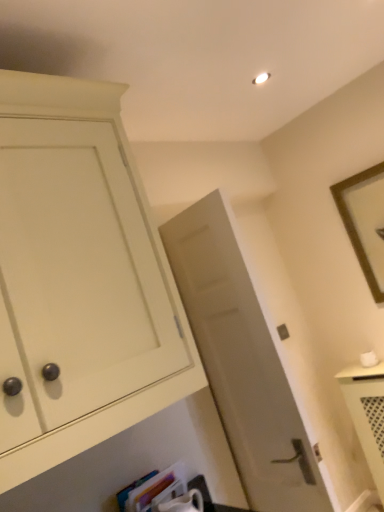
In the scene shown: Measure the distance between point (352,204) and camera.

They are 8.20 feet apart.

Based on the photo, measure the distance between brown wooden picture frame at upper right and camera.

brown wooden picture frame at upper right and camera are 7.76 feet apart from each other.

Where is `brown wooden picture frame at upper right`? brown wooden picture frame at upper right is located at coordinates (365, 222).

Consider the image. Is brown wooden picture frame at upper right spatially inside matte gray door at center, or outside of it?

brown wooden picture frame at upper right is located beyond the bounds of matte gray door at center.

From the picture: Is brown wooden picture frame at upper right further to camera compared to matte gray door at center?

Yes, brown wooden picture frame at upper right is behind matte gray door at center.

Is brown wooden picture frame at upper right bigger than matte gray door at center?

No.

From a real-world perspective, between brown wooden picture frame at upper right and matte gray door at center, who is vertically higher?

brown wooden picture frame at upper right.

Is hardcover book at lower center in contact with matte white cabinet at left?

No, hardcover book at lower center is not next to matte white cabinet at left.

Between hardcover book at lower center and matte white cabinet at left, which one appears on the right side from the viewer's perspective?

hardcover book at lower center.

From a real-world perspective, who is located higher, hardcover book at lower center or matte white cabinet at left?

In real-world perspective, matte white cabinet at left is above.

The width and height of the screenshot is (384, 512). Find the location of `cabinetry above the hardcover book at lower center (from a real-world perspective)`. cabinetry above the hardcover book at lower center (from a real-world perspective) is located at coordinates (79, 279).

Does point (157, 487) appear closer or farther from the camera than point (363, 181)?

Point (157, 487).

From the image's perspective, is hardcover book at lower center on top of brown wooden picture frame at upper right?

Incorrect, from the image's perspective, hardcover book at lower center is lower than brown wooden picture frame at upper right.

Can you confirm if hardcover book at lower center is bigger than brown wooden picture frame at upper right?

No, hardcover book at lower center is not bigger than brown wooden picture frame at upper right.

How different are the orientations of hardcover book at lower center and brown wooden picture frame at upper right in degrees?

89.3 degrees separate the facing orientations of hardcover book at lower center and brown wooden picture frame at upper right.

Is matte gray door at center closer to the viewer compared to hardcover book at lower center?

No, matte gray door at center is further to the viewer.

Is matte gray door at center outside of hardcover book at lower center?

Yes, matte gray door at center is outside of hardcover book at lower center.

Are matte gray door at center and hardcover book at lower center far apart?

Actually, matte gray door at center and hardcover book at lower center are a little close together.

Which object is thinner, matte gray door at center or hardcover book at lower center?

Thinner between the two is matte gray door at center.

From a real-world perspective, is brown wooden picture frame at upper right above or below hardcover book at lower center?

Clearly, from a real-world perspective, brown wooden picture frame at upper right is above hardcover book at lower center.

Between brown wooden picture frame at upper right and hardcover book at lower center, which one is positioned behind?

brown wooden picture frame at upper right.

Could you tell me if brown wooden picture frame at upper right is facing hardcover book at lower center?

Yes, brown wooden picture frame at upper right is turned towards hardcover book at lower center.

Considering the sizes of objects matte white cabinet at left and hardcover book at lower center in the image provided, who is wider, matte white cabinet at left or hardcover book at lower center?

matte white cabinet at left is wider.

Does point (98, 170) appear closer or farther from the camera than point (137, 488)?

Clearly, point (98, 170) is closer to the camera than point (137, 488).

Does matte white cabinet at left contain hardcover book at lower center?

Definitely not — hardcover book at lower center is not inside matte white cabinet at left.

Could you tell me if brown wooden picture frame at upper right is facing matte white cabinet at left?

Yes.

From the image's perspective, which is below, brown wooden picture frame at upper right or matte white cabinet at left?

matte white cabinet at left is shown below in the image.

Considering the relative positions of brown wooden picture frame at upper right and matte white cabinet at left in the image provided, is brown wooden picture frame at upper right to the right of matte white cabinet at left from the viewer's perspective?

Yes, brown wooden picture frame at upper right is to the right of matte white cabinet at left.

Is brown wooden picture frame at upper right inside the boundaries of matte white cabinet at left, or outside?

brown wooden picture frame at upper right lies outside matte white cabinet at left.

At what (x,y) coordinates should I click in order to perform the action: click on door on the left of brown wooden picture frame at upper right. Please return your answer as a coordinate pair (x, y). The image size is (384, 512). Looking at the image, I should click on (243, 362).

Find the location of a particular element. This screenshot has height=512, width=384. book on the right side of matte white cabinet at left is located at coordinates (153, 489).

Which object lies further to the anchor point matte gray door at center, brown wooden picture frame at upper right or hardcover book at lower center?

brown wooden picture frame at upper right lies further to matte gray door at center than the other object.

Estimate the real-world distances between objects in this image. Which object is closer to matte gray door at center, matte white cabinet at left or brown wooden picture frame at upper right?

matte white cabinet at left lies closer to matte gray door at center than the other object.

When comparing their distances from matte white cabinet at left, does brown wooden picture frame at upper right or hardcover book at lower center seem further?

Based on the image, brown wooden picture frame at upper right appears to be further to matte white cabinet at left.

Considering their positions, is matte gray door at center positioned closer to brown wooden picture frame at upper right than hardcover book at lower center?

matte gray door at center is positioned closer to the anchor brown wooden picture frame at upper right.

From the picture: Looking at the image, which one is located further to matte gray door at center, brown wooden picture frame at upper right or matte white cabinet at left?

The object further to matte gray door at center is brown wooden picture frame at upper right.

From the image, which object appears to be nearer to hardcover book at lower center, matte white cabinet at left or brown wooden picture frame at upper right?

Among the two, matte white cabinet at left is located nearer to hardcover book at lower center.

Considering their positions, is matte gray door at center positioned closer to hardcover book at lower center than matte white cabinet at left?

Based on the image, matte gray door at center appears to be nearer to hardcover book at lower center.

Looking at the image, which one is located further to brown wooden picture frame at upper right, hardcover book at lower center or matte gray door at center?

hardcover book at lower center.

Locate an element on the screen. The height and width of the screenshot is (512, 384). door between hardcover book at lower center and brown wooden picture frame at upper right in the horizontal direction is located at coordinates (243, 362).

At what (x,y) coordinates should I click in order to perform the action: click on book located between matte white cabinet at left and brown wooden picture frame at upper right in the left-right direction. Please return your answer as a coordinate pair (x, y). Looking at the image, I should click on (153, 489).

Find the location of a particular element. This screenshot has height=512, width=384. door that lies between matte white cabinet at left and hardcover book at lower center from top to bottom is located at coordinates (243, 362).

The width and height of the screenshot is (384, 512). I want to click on door located between matte white cabinet at left and brown wooden picture frame at upper right in the left-right direction, so click(x=243, y=362).